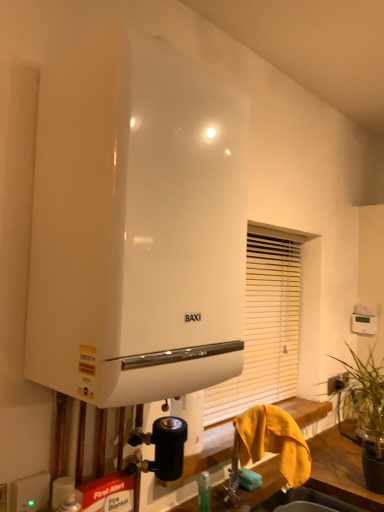
Question: Is white glossy water heater at center positioned beyond the bounds of white matte shutter at center?

Choices:
 (A) no
 (B) yes

Answer: (B)

Question: Could white matte shutter at center be considered to be inside white glossy water heater at center?

Choices:
 (A) yes
 (B) no

Answer: (B)

Question: From a real-world perspective, is white glossy water heater at center physically below white matte shutter at center?

Choices:
 (A) no
 (B) yes

Answer: (A)

Question: Is white glossy water heater at center with white matte shutter at center?

Choices:
 (A) yes
 (B) no

Answer: (B)

Question: Is white glossy water heater at center not near white matte shutter at center?

Choices:
 (A) no
 (B) yes

Answer: (A)

Question: Is the depth of white glossy water heater at center greater than that of white matte shutter at center?

Choices:
 (A) yes
 (B) no

Answer: (B)

Question: Is white glossy water heater at center bigger than white plastic electric outlet at lower left?

Choices:
 (A) yes
 (B) no

Answer: (A)

Question: Are white glossy water heater at center and white plastic electric outlet at lower left located far from each other?

Choices:
 (A) yes
 (B) no

Answer: (B)

Question: Does white glossy water heater at center contain white plastic electric outlet at lower left?

Choices:
 (A) yes
 (B) no

Answer: (B)

Question: Is white glossy water heater at center next to white plastic electric outlet at lower left?

Choices:
 (A) yes
 (B) no

Answer: (B)

Question: From the image's perspective, is white glossy water heater at center under white plastic electric outlet at lower left?

Choices:
 (A) yes
 (B) no

Answer: (B)

Question: Is white glossy water heater at center thinner than white plastic electric outlet at lower left?

Choices:
 (A) no
 (B) yes

Answer: (A)

Question: Is white glossy sink at lower center surrounding white glossy water heater at center?

Choices:
 (A) yes
 (B) no

Answer: (B)